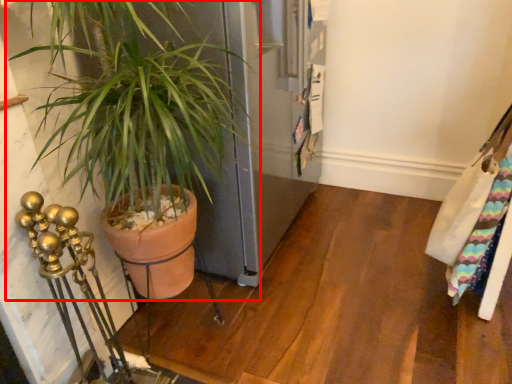
Question: From the image's perspective, what is the correct spatial relationship of houseplant (annotated by the red box) in relation to messenger bag?

Choices:
 (A) above
 (B) below

Answer: (B)